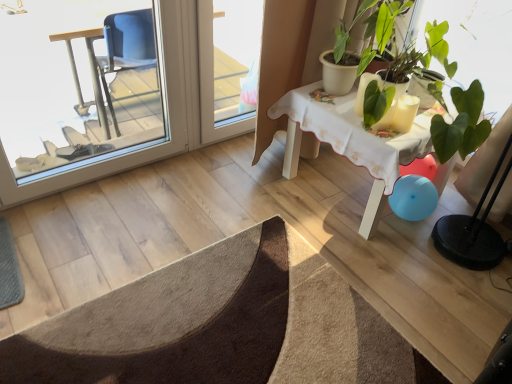
Locate an element on the screen. Image resolution: width=512 pixels, height=384 pixels. transparent glass screen door at left, placed as the second screen door when sorted from right to left is located at coordinates (165, 110).

Consider the image. In order to face white wooden table at upper right, should I rotate leftwards or rightwards?

It's best to rotate right around 14.762 degrees.

Image resolution: width=512 pixels, height=384 pixels. Describe the element at coordinates (350, 143) in the screenshot. I see `white wooden table at upper right` at that location.

I want to click on transparent glass screen door at left, which is the first screen door from left to right, so click(165, 110).

How far apart are transparent plastic screen door at upper center, marked as the 1th screen door in a right-to-left arrangement, and brown textured doormat at lower left?

transparent plastic screen door at upper center, marked as the 1th screen door in a right-to-left arrangement, and brown textured doormat at lower left are 1.10 meters apart from each other.

Is transparent plastic screen door at upper center, marked as the 1th screen door in a right-to-left arrangement, positioned in front of brown textured doormat at lower left?

No, transparent plastic screen door at upper center, marked as the 1th screen door in a right-to-left arrangement, is further to the viewer.

Which is in front, point (224, 58) or point (51, 375)?

The point (51, 375) is closer to the camera.

Which object is thinner, transparent plastic screen door at upper center, marked as the 1th screen door in a right-to-left arrangement, or brown textured doormat at lower left?

With smaller width is transparent plastic screen door at upper center, marked as the 1th screen door in a right-to-left arrangement.

Is white wooden table at upper right far away from transparent glass screen door at left, which is the first screen door from left to right?

That's not correct — white wooden table at upper right is a little close to transparent glass screen door at left, which is the first screen door from left to right.

Locate an element on the screen. The width and height of the screenshot is (512, 384). screen door that is the 1st object located above the white wooden table at upper right (from the image's perspective) is located at coordinates (165, 110).

Is white wooden table at upper right to the right of transparent glass screen door at left, placed as the second screen door when sorted from right to left, from the viewer's perspective?

Yes.

Which point is more forward, (x=413, y=101) or (x=200, y=83)?

The point (x=413, y=101) is closer.

From the picture: From a real-world perspective, which object rests below the other?

transparent plastic screen door at upper center, marked as the 1th screen door in a right-to-left arrangement.

From the picture: Is transparent plastic screen door at upper center, which ranks as the 2th screen door in left-to-right order, surrounded by white glossy candle at upper right?

No, transparent plastic screen door at upper center, which ranks as the 2th screen door in left-to-right order, is not surrounded by white glossy candle at upper right.

Is brown textured doormat at lower left placed right next to white wooden table at upper right?

brown textured doormat at lower left and white wooden table at upper right are not in contact.

Is brown textured doormat at lower left shorter than white wooden table at upper right?

Indeed, brown textured doormat at lower left has a lesser height compared to white wooden table at upper right.

Can you confirm if brown textured doormat at lower left is wider than white wooden table at upper right?

Yes, brown textured doormat at lower left is wider than white wooden table at upper right.

Which object is closer to the camera taking this photo, brown textured doormat at lower left or white glossy candle at upper right?

Positioned in front is brown textured doormat at lower left.

How far apart are brown textured doormat at lower left and white glossy candle at upper right?

The distance of brown textured doormat at lower left from white glossy candle at upper right is 35.71 inches.

Which is behind, point (67, 362) or point (400, 111)?

Point (400, 111)

The height and width of the screenshot is (384, 512). In order to click on candle holder above the brown textured doormat at lower left (from the image's perspective) in this screenshot , I will do `click(405, 113)`.

Is brown textured doormat at lower left not within transparent plastic screen door at upper center, which ranks as the 2th screen door in left-to-right order?

That's correct, brown textured doormat at lower left is outside of transparent plastic screen door at upper center, which ranks as the 2th screen door in left-to-right order.

From the image's perspective, is brown textured doormat at lower left beneath transparent plastic screen door at upper center, which ranks as the 2th screen door in left-to-right order?

Correct, brown textured doormat at lower left appears lower than transparent plastic screen door at upper center, which ranks as the 2th screen door in left-to-right order, in the image.

Which of these two, brown textured doormat at lower left or transparent plastic screen door at upper center, which ranks as the 2th screen door in left-to-right order, is thinner?

With smaller width is transparent plastic screen door at upper center, which ranks as the 2th screen door in left-to-right order.

Which object is positioned more to the right, brown textured doormat at lower left or transparent plastic screen door at upper center, which ranks as the 2th screen door in left-to-right order?

transparent plastic screen door at upper center, which ranks as the 2th screen door in left-to-right order, is more to the right.

How many degrees apart are the facing directions of transparent glass screen door at left, placed as the second screen door when sorted from right to left, and transparent plastic screen door at upper center, which ranks as the 2th screen door in left-to-right order?

transparent glass screen door at left, placed as the second screen door when sorted from right to left, and transparent plastic screen door at upper center, which ranks as the 2th screen door in left-to-right order, are facing 4.79 degrees away from each other.

Is there a large distance between transparent glass screen door at left, placed as the second screen door when sorted from right to left, and transparent plastic screen door at upper center, which ranks as the 2th screen door in left-to-right order?

Actually, transparent glass screen door at left, placed as the second screen door when sorted from right to left, and transparent plastic screen door at upper center, which ranks as the 2th screen door in left-to-right order, are a little close together.

Between transparent glass screen door at left, which is the first screen door from left to right, and transparent plastic screen door at upper center, marked as the 1th screen door in a right-to-left arrangement, which one appears on the left side from the viewer's perspective?

transparent glass screen door at left, which is the first screen door from left to right, is more to the left.

Is the depth of transparent glass screen door at left, which is the first screen door from left to right, less than that of transparent plastic screen door at upper center, which ranks as the 2th screen door in left-to-right order?

Yes.

Where is `the 2nd screen door above the brown textured doormat at lower left (from the image's perspective)`? the 2nd screen door above the brown textured doormat at lower left (from the image's perspective) is located at coordinates (228, 65).

This screenshot has height=384, width=512. I want to click on table that appears below the transparent glass screen door at left, placed as the second screen door when sorted from right to left (from a real-world perspective), so click(350, 143).

Estimate the real-world distances between objects in this image. Which object is further from white glossy candle at upper right, brown textured doormat at lower left or transparent glass screen door at left, which is the first screen door from left to right?

transparent glass screen door at left, which is the first screen door from left to right.

From the image, which object appears to be farther from transparent plastic screen door at upper center, which ranks as the 2th screen door in left-to-right order, brown textured doormat at lower left or transparent glass screen door at left, placed as the second screen door when sorted from right to left?

brown textured doormat at lower left lies further to transparent plastic screen door at upper center, which ranks as the 2th screen door in left-to-right order, than the other object.

Based on their spatial positions, is transparent plastic screen door at upper center, marked as the 1th screen door in a right-to-left arrangement, or brown textured doormat at lower left further from white wooden table at upper right?

brown textured doormat at lower left is positioned further to the anchor white wooden table at upper right.

Considering their positions, is transparent plastic screen door at upper center, which ranks as the 2th screen door in left-to-right order, positioned closer to transparent glass screen door at left, which is the first screen door from left to right, than white glossy candle at upper right?

transparent plastic screen door at upper center, which ranks as the 2th screen door in left-to-right order.

Looking at this image, estimate the real-world distances between objects in this image. Which object is closer to white wooden table at upper right, white glossy candle at upper right or transparent plastic screen door at upper center, which ranks as the 2th screen door in left-to-right order?

white glossy candle at upper right.

Estimate the real-world distances between objects in this image. Which object is further from brown textured doormat at lower left, white glossy candle at upper right or transparent glass screen door at left, which is the first screen door from left to right?

white glossy candle at upper right is positioned further to the anchor brown textured doormat at lower left.

From the image, which object appears to be farther from brown textured doormat at lower left, transparent plastic screen door at upper center, marked as the 1th screen door in a right-to-left arrangement, or transparent glass screen door at left, placed as the second screen door when sorted from right to left?

Based on the image, transparent plastic screen door at upper center, marked as the 1th screen door in a right-to-left arrangement, appears to be further to brown textured doormat at lower left.

Looking at the image, which one is located closer to transparent glass screen door at left, which is the first screen door from left to right, transparent plastic screen door at upper center, marked as the 1th screen door in a right-to-left arrangement, or brown textured doormat at lower left?

The object closer to transparent glass screen door at left, which is the first screen door from left to right, is transparent plastic screen door at upper center, marked as the 1th screen door in a right-to-left arrangement.

Where is `table located between transparent plastic screen door at upper center, marked as the 1th screen door in a right-to-left arrangement, and white glossy candle at upper right in the left-right direction`? Image resolution: width=512 pixels, height=384 pixels. table located between transparent plastic screen door at upper center, marked as the 1th screen door in a right-to-left arrangement, and white glossy candle at upper right in the left-right direction is located at coordinates (350, 143).

Identify the location of screen door between transparent glass screen door at left, which is the first screen door from left to right, and white wooden table at upper right, in the horizontal direction. (228, 65).

Locate an element on the screen. table between transparent glass screen door at left, which is the first screen door from left to right, and white glossy candle at upper right, in the horizontal direction is located at coordinates (x=350, y=143).

At what (x,y) coordinates should I click in order to perform the action: click on screen door that lies between transparent plastic screen door at upper center, which ranks as the 2th screen door in left-to-right order, and brown textured doormat at lower left from top to bottom. Please return your answer as a coordinate pair (x, y). The height and width of the screenshot is (384, 512). Looking at the image, I should click on (165, 110).